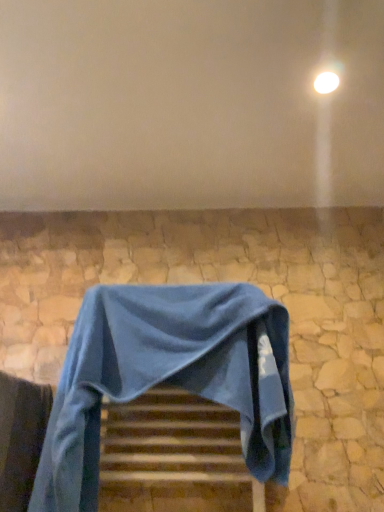
Locate an element on the screen. Image resolution: width=384 pixels, height=512 pixels. white glossy light at upper right is located at coordinates (326, 82).

The height and width of the screenshot is (512, 384). What do you see at coordinates (170, 449) in the screenshot? I see `wooden stairs at center` at bounding box center [170, 449].

This screenshot has width=384, height=512. In order to click on blue fabric chair at center in this screenshot , I will do coord(168,377).

Is blue fabric chair at center beside wooden stairs at center?

There is a gap between blue fabric chair at center and wooden stairs at center.

Which is less distant, (230, 305) or (149, 494)?

Positioned in front is point (230, 305).

Can you confirm if blue fabric chair at center is smaller than wooden stairs at center?

No.

Is blue fabric chair at center wider or thinner than wooden stairs at center?

Considering their sizes, blue fabric chair at center looks broader than wooden stairs at center.

This screenshot has height=512, width=384. There is a wooden stairs at center. Identify the location of furniture above it (from a real-world perspective). (168, 377).

Could you tell me if wooden stairs at center is turned towards blue fabric chair at center?

Yes, wooden stairs at center is oriented towards blue fabric chair at center.

From a real-world perspective, is wooden stairs at center physically below blue fabric chair at center?

Yes, from a real-world perspective, wooden stairs at center is beneath blue fabric chair at center.

Which object is positioned more to the left, wooden stairs at center or blue fabric chair at center?

From the viewer's perspective, blue fabric chair at center appears more on the left side.

From the image's perspective, which object appears higher, white glossy light at upper right or blue fabric chair at center?

white glossy light at upper right.

Can you confirm if white glossy light at upper right is shorter than blue fabric chair at center?

Indeed, white glossy light at upper right has a lesser height compared to blue fabric chair at center.

Can you tell me how much white glossy light at upper right and blue fabric chair at center differ in facing direction?

They differ by 0.158 degrees in their facing directions.

Which is more to the right, white glossy light at upper right or blue fabric chair at center?

white glossy light at upper right is more to the right.

Would you say white glossy light at upper right is outside matte white wall at upper center?

No, most part of white glossy light at upper right lies within matte white wall at upper center.

In terms of size, does white glossy light at upper right appear bigger or smaller than matte white wall at upper center?

Considering their sizes, white glossy light at upper right takes up less space than matte white wall at upper center.

Could you tell me if white glossy light at upper right is turned towards matte white wall at upper center?

Yes, white glossy light at upper right is facing matte white wall at upper center.

Is white glossy light at upper right in front of or behind matte white wall at upper center in the image?

white glossy light at upper right is positioned farther from the viewer than matte white wall at upper center.

From a real-world perspective, which object rests below the other?

wooden stairs at center is physically lower.

Visually, is white glossy light at upper right positioned to the left or to the right of wooden stairs at center?

white glossy light at upper right is positioned on wooden stairs at center's right side.

Considering the sizes of objects white glossy light at upper right and wooden stairs at center in the image provided, who is taller, white glossy light at upper right or wooden stairs at center?

wooden stairs at center.

Could you tell me if white glossy light at upper right is facing wooden stairs at center?

No, white glossy light at upper right does not turn towards wooden stairs at center.

Is wooden stairs at center wider than white glossy light at upper right?

Indeed, wooden stairs at center has a greater width compared to white glossy light at upper right.

From a real-world perspective, is wooden stairs at center on top of white glossy light at upper right?

No, from a real-world perspective, wooden stairs at center is not above white glossy light at upper right.

Considering the relative positions of wooden stairs at center and white glossy light at upper right in the image provided, is wooden stairs at center to the left or to the right of white glossy light at upper right?

From the image, it's evident that wooden stairs at center is to the left of white glossy light at upper right.

How many degrees apart are the facing directions of wooden stairs at center and white glossy light at upper right?

The angle between the facing direction of wooden stairs at center and the facing direction of white glossy light at upper right is 0.158 degrees.

Which is more to the right, matte white wall at upper center or blue fabric chair at center?

Positioned to the right is matte white wall at upper center.

Locate an element on the screen. Image resolution: width=384 pixels, height=512 pixels. backdrop on the right of blue fabric chair at center is located at coordinates (190, 104).

Considering the positions of objects matte white wall at upper center and blue fabric chair at center in the image provided, who is behind, matte white wall at upper center or blue fabric chair at center?

blue fabric chair at center.

Is matte white wall at upper center facing away from blue fabric chair at center?

That's not correct — matte white wall at upper center is not looking away from blue fabric chair at center.

At what (x,y) coordinates should I click in order to perform the action: click on furniture that is in front of the wooden stairs at center. Please return your answer as a coordinate pair (x, y). Looking at the image, I should click on (168, 377).

Locate an element on the screen. The width and height of the screenshot is (384, 512). stairs below the blue fabric chair at center (from the image's perspective) is located at coordinates (170, 449).

When comparing their distances from matte white wall at upper center, does blue fabric chair at center or white glossy light at upper right seem further?

blue fabric chair at center is positioned further to the anchor matte white wall at upper center.

Looking at the image, which one is located closer to matte white wall at upper center, wooden stairs at center or blue fabric chair at center?

blue fabric chair at center is closer to matte white wall at upper center.

Which object lies further to the anchor point matte white wall at upper center, wooden stairs at center or white glossy light at upper right?

The object further to matte white wall at upper center is wooden stairs at center.

Estimate the real-world distances between objects in this image. Which object is further from wooden stairs at center, white glossy light at upper right or blue fabric chair at center?

white glossy light at upper right lies further to wooden stairs at center than the other object.

Considering their positions, is wooden stairs at center positioned further to blue fabric chair at center than matte white wall at upper center?

Based on the image, matte white wall at upper center appears to be further to blue fabric chair at center.

Based on their spatial positions, is wooden stairs at center or matte white wall at upper center closer to white glossy light at upper right?

matte white wall at upper center is closer to white glossy light at upper right.

Looking at the image, which one is located closer to blue fabric chair at center, matte white wall at upper center or wooden stairs at center?

The object closer to blue fabric chair at center is wooden stairs at center.

When comparing their distances from white glossy light at upper right, does blue fabric chair at center or wooden stairs at center seem closer?

Based on the image, blue fabric chair at center appears to be nearer to white glossy light at upper right.

Find the location of `furniture between matte white wall at upper center and wooden stairs at center in the vertical direction`. furniture between matte white wall at upper center and wooden stairs at center in the vertical direction is located at coordinates (168, 377).

Locate an element on the screen. backdrop between white glossy light at upper right and wooden stairs at center vertically is located at coordinates (190, 104).

Locate an element on the screen. furniture between white glossy light at upper right and wooden stairs at center vertically is located at coordinates (168, 377).

Where is `backdrop between white glossy light at upper right and blue fabric chair at center vertically`? The image size is (384, 512). backdrop between white glossy light at upper right and blue fabric chair at center vertically is located at coordinates (190, 104).